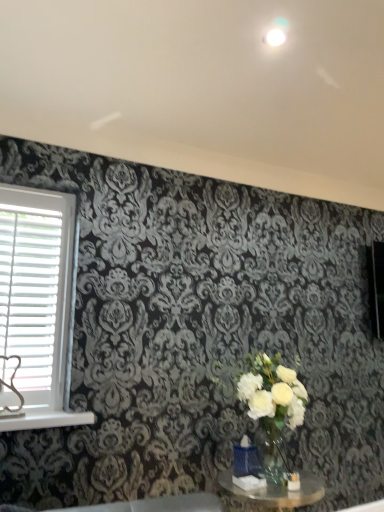
At what (x,y) coordinates should I click in order to perform the action: click on clear glass table at lower center. Please return your answer as a coordinate pair (x, y). Looking at the image, I should click on (269, 494).

Consider the image. From the image's perspective, is white plastic blinds at left positioned above or below white plastic window sill at lower left?

white plastic blinds at left is situated higher than white plastic window sill at lower left in the image.

Is white plastic blinds at left shorter than white plastic window sill at lower left?

In fact, white plastic blinds at left may be taller than white plastic window sill at lower left.

Is white plastic blinds at left oriented towards white plastic window sill at lower left?

No.

How many degrees apart are the facing directions of white plastic blinds at left and white plastic window sill at lower left?

The angular difference between white plastic blinds at left and white plastic window sill at lower left is 0.00881 degrees.

Which is farther, (22, 188) or (230, 474)?

The point (22, 188) is behind.

Where is `table below the white plastic blinds at left (from the image's perspective)`? The width and height of the screenshot is (384, 512). table below the white plastic blinds at left (from the image's perspective) is located at coordinates (269, 494).

From the image's perspective, is white plastic blinds at left beneath clear glass table at lower center?

Incorrect, from the image's perspective, white plastic blinds at left is higher than clear glass table at lower center.

Is white plastic blinds at left not near clear glass table at lower center?

white plastic blinds at left is far away from clear glass table at lower center.

Is clear glass table at lower center behind white plastic window sill at lower left?

No, clear glass table at lower center is closer to the viewer.

Between clear glass table at lower center and white plastic window sill at lower left, which one has larger width?

Wider between the two is clear glass table at lower center.

You are a GUI agent. You are given a task and a screenshot of the screen. Output one action in this format:
    pyautogui.click(x=<x>, y=<y>)
    Task: Click on the table that is under the white plastic window sill at lower left (from a real-world perspective)
    The height and width of the screenshot is (512, 384).
    Given the screenshot: What is the action you would take?
    pyautogui.click(x=269, y=494)

Between white plastic window sill at lower left and white plastic blinds at left, which one has less height?

white plastic window sill at lower left.

Is white plastic window sill at lower left surrounding white plastic blinds at left?

No, white plastic blinds at left is not surrounded by white plastic window sill at lower left.

Between point (88, 422) and point (34, 245), which one is positioned in front?

Point (88, 422)

In the scene shown: From a real-world perspective, is white plastic window sill at lower left over white plastic blinds at left?

Incorrect, from a real-world perspective, white plastic window sill at lower left is lower than white plastic blinds at left.

Identify the location of window that appears above the clear glass table at lower center (from a real-world perspective). (36, 307).

Considering the relative sizes of clear glass table at lower center and white plastic blinds at left in the image provided, is clear glass table at lower center shorter than white plastic blinds at left?

Yes.

Is clear glass table at lower center spatially inside white plastic blinds at left, or outside of it?

clear glass table at lower center is not enclosed by white plastic blinds at left.

Which point is more forward, (322, 488) or (32, 191)?

The point (322, 488) is closer to the camera.

Is the depth of white plastic window sill at lower left less than that of clear glass table at lower center?

No, white plastic window sill at lower left is behind clear glass table at lower center.

From the image's perspective, is white plastic window sill at lower left positioned above or below clear glass table at lower center?

From the image's perspective, white plastic window sill at lower left appears above clear glass table at lower center.

From a real-world perspective, who is located lower, white plastic window sill at lower left or clear glass table at lower center?

clear glass table at lower center.

At what (x,y) coordinates should I click in order to perform the action: click on window sill located on the right of white plastic blinds at left. Please return your answer as a coordinate pair (x, y). This screenshot has width=384, height=512. Looking at the image, I should click on (45, 420).

Where is `window that appears behind the clear glass table at lower center`? The image size is (384, 512). window that appears behind the clear glass table at lower center is located at coordinates (36, 307).

Based on the photo, looking at the image, which one is located closer to white plastic blinds at left, white plastic window sill at lower left or clear glass table at lower center?

The object closer to white plastic blinds at left is white plastic window sill at lower left.

Estimate the real-world distances between objects in this image. Which object is closer to white plastic window sill at lower left, white plastic blinds at left or clear glass table at lower center?

The object closer to white plastic window sill at lower left is white plastic blinds at left.

Estimate the real-world distances between objects in this image. Which object is further from clear glass table at lower center, white plastic window sill at lower left or white plastic blinds at left?

Among the two, white plastic blinds at left is located further to clear glass table at lower center.

Considering their positions, is clear glass table at lower center positioned closer to white plastic window sill at lower left than white plastic blinds at left?

Among the two, white plastic blinds at left is located nearer to white plastic window sill at lower left.

Estimate the real-world distances between objects in this image. Which object is further from clear glass table at lower center, white plastic blinds at left or white plastic window sill at lower left?

white plastic blinds at left.

Which object lies further to the anchor point white plastic blinds at left, clear glass table at lower center or white plastic window sill at lower left?

clear glass table at lower center is further to white plastic blinds at left.

Where is `window sill between white plastic blinds at left and clear glass table at lower center in the horizontal direction`? window sill between white plastic blinds at left and clear glass table at lower center in the horizontal direction is located at coordinates (45, 420).